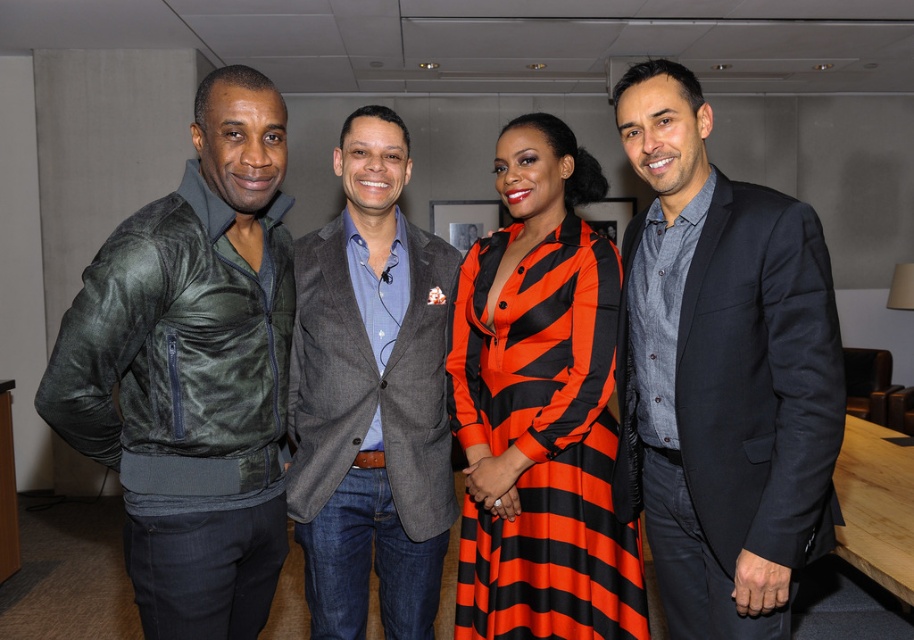
Can you confirm if green leather jacket at left is wider than orange-black striped dress at center?

No.

Is green leather jacket at left in front of orange-black striped dress at center?

Yes, green leather jacket at left is closer to the viewer.

Which is behind, point (166, 356) or point (530, 627)?

The point (530, 627) is behind.

Where is `green leather jacket at left`? The height and width of the screenshot is (640, 914). green leather jacket at left is located at coordinates (192, 371).

Based on the photo, who is more distant from viewer, (618, 532) or (322, 348)?

The point (322, 348) is behind.

Can you confirm if orange-black striped dress at center is positioned to the right of gray wool blazer at center?

Indeed, orange-black striped dress at center is positioned on the right side of gray wool blazer at center.

In order to click on orange-black striped dress at center in this screenshot , I will do `click(540, 406)`.

Find the location of a particular element. Image resolution: width=914 pixels, height=640 pixels. orange-black striped dress at center is located at coordinates (540, 406).

Is dark blue suit at right taller than gray wool blazer at center?

No.

Does point (668, 120) come in front of point (324, 541)?

Yes.

At what (x,y) coordinates should I click in order to perform the action: click on dark blue suit at right. Please return your answer as a coordinate pair (x, y). The width and height of the screenshot is (914, 640). Looking at the image, I should click on (721, 372).